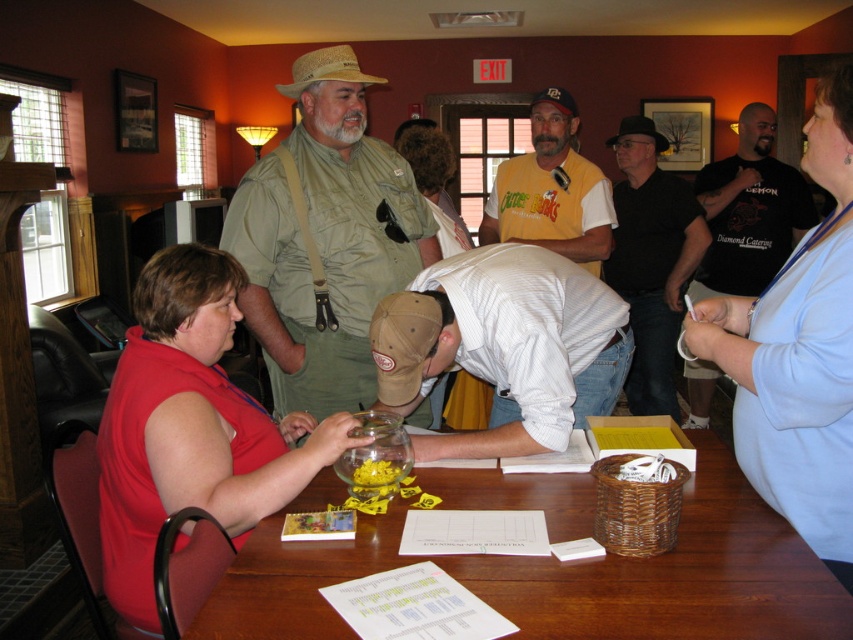
You are organizing a clothing donation drive and need to pack items into boxes. The black cotton shirt at center and the yellow jersey at center are both to be packed. Given their sizes, which one would you place first into the box to maximize space efficiency?

The black cotton shirt at center has a smaller width than the yellow jersey at center, so it should be placed first into the box to allow the larger yellow jersey at center to be folded or arranged around it for better space efficiency.